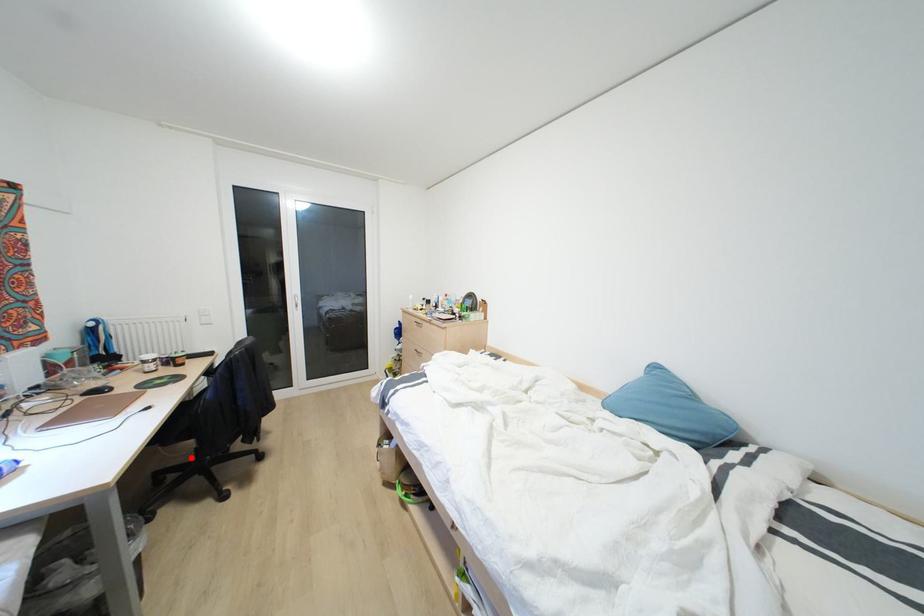
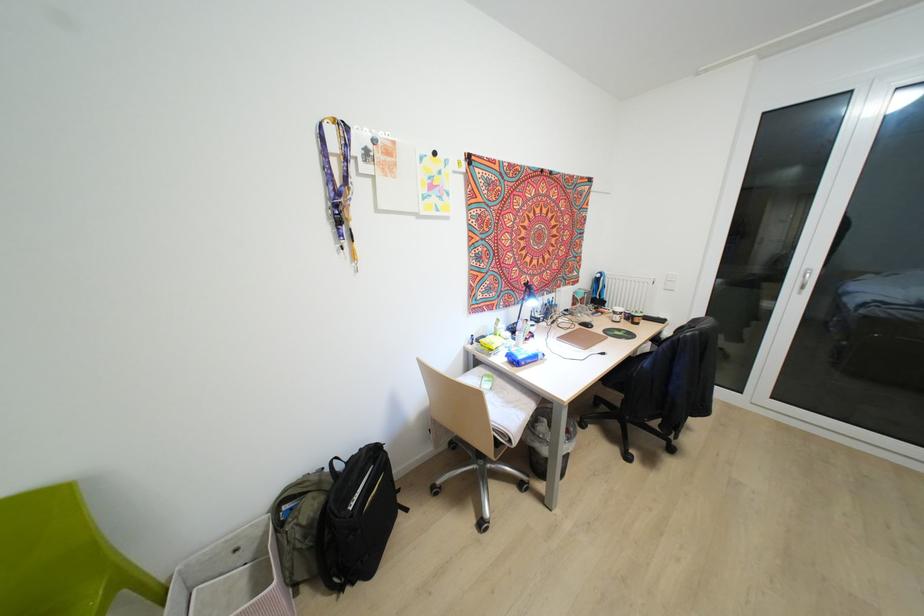
In the second image, find the point that corresponds to the highlighted location in the first image.

(617, 405)